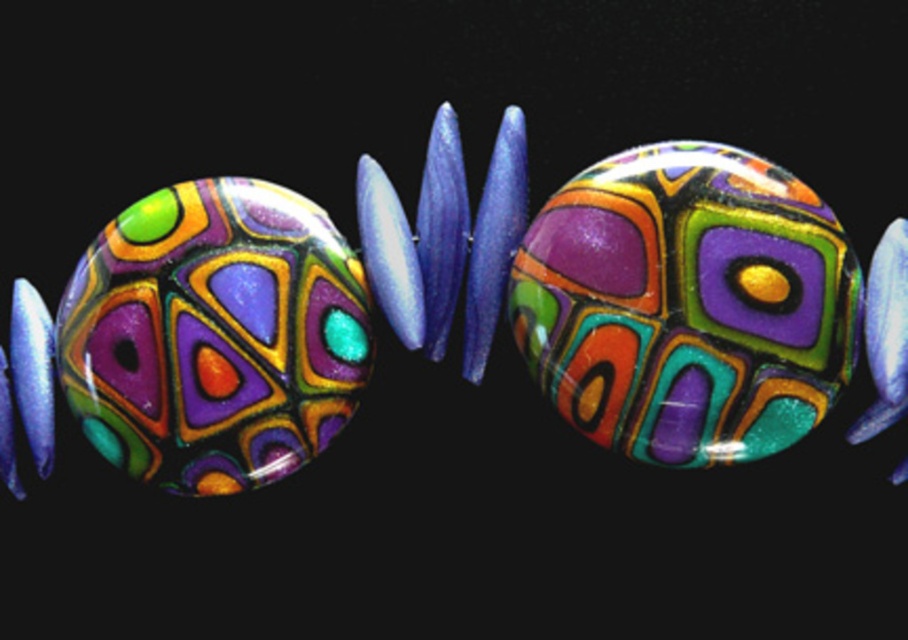
Question: Among these points, which one is farthest from the camera?

Choices:
 (A) (530, 360)
 (B) (132, 390)

Answer: (A)

Question: Is glossy glass bead at center to the left of glossy glass bead at left from the viewer's perspective?

Choices:
 (A) yes
 (B) no

Answer: (B)

Question: Which object appears farthest from the camera in this image?

Choices:
 (A) glossy glass bead at center
 (B) glossy glass bead at left

Answer: (B)

Question: Which point is farther to the camera?

Choices:
 (A) (149, 422)
 (B) (728, 433)

Answer: (A)

Question: Where is glossy glass bead at center located in relation to glossy glass bead at left in the image?

Choices:
 (A) below
 (B) above

Answer: (B)

Question: Does glossy glass bead at center appear on the left side of glossy glass bead at left?

Choices:
 (A) no
 (B) yes

Answer: (A)